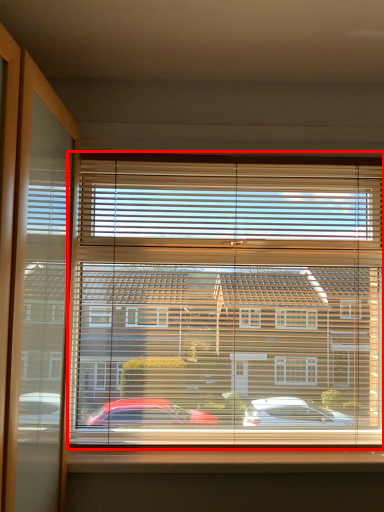
Question: Considering the relative positions of window blind (annotated by the red box) and window sill in the image provided, where is window blind (annotated by the red box) located with respect to the staircase?

Choices:
 (A) right
 (B) left

Answer: (A)